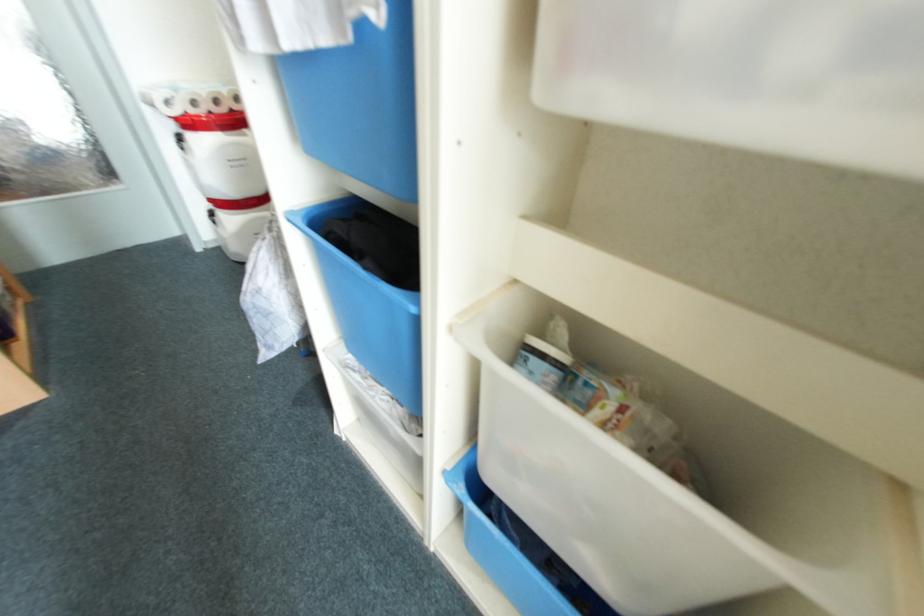
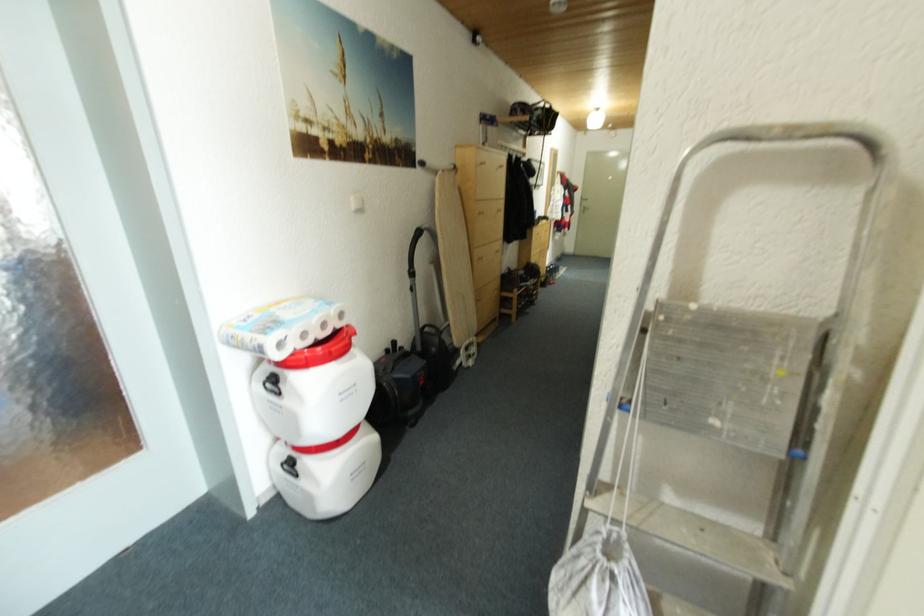
Question: The images are taken continuously from a first-person perspective. In which direction are you moving?

Choices:
 (A) Left
 (B) Right
 (C) Forward
 (D) Backward

Answer: (A)